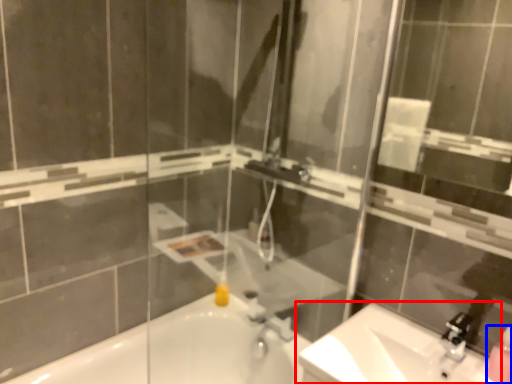
Question: Which point is closer to the camera, sink (highlighted by a red box) or soap dispenser (highlighted by a blue box)?

Choices:
 (A) sink
 (B) soap dispenser

Answer: (A)